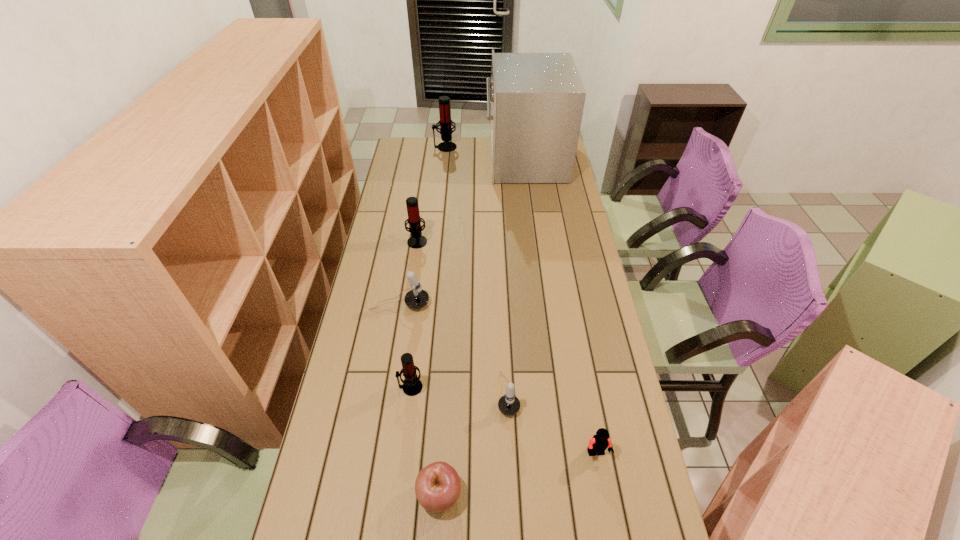
Where is `toaster oven`? toaster oven is located at coordinates [537, 99].

The height and width of the screenshot is (540, 960). Identify the location of the farthest microphone. (445, 121).

At what (x,y) coordinates should I click in order to perform the action: click on the tallest microphone. Please return your answer as a coordinate pair (x, y). Looking at the image, I should click on (445, 121).

What are the coordinates of `the second tallest microphone` in the screenshot? It's located at (416, 241).

Find the location of a particular element. the third farthest object is located at coordinates (416, 241).

Where is `the left white microphone`? The image size is (960, 540). the left white microphone is located at coordinates (416, 298).

Where is `the third nearest microphone`? This screenshot has width=960, height=540. the third nearest microphone is located at coordinates (416, 298).

This screenshot has height=540, width=960. I want to click on the smallest red microphone, so click(x=412, y=385).

At what (x,y) coordinates should I click in order to perform the action: click on the rightmost microphone. Please return your answer as a coordinate pair (x, y). Looking at the image, I should click on (509, 405).

Where is `the smaller white microphone`? The width and height of the screenshot is (960, 540). the smaller white microphone is located at coordinates click(x=509, y=405).